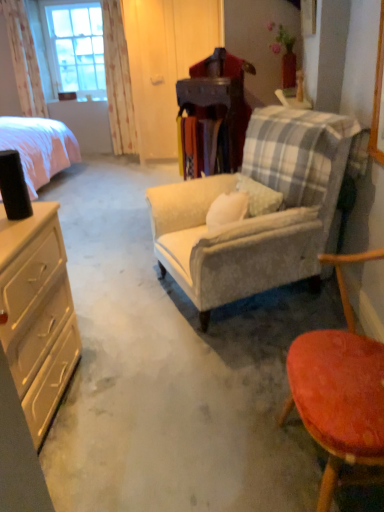
This screenshot has width=384, height=512. Find the location of `vacant space to the left of smooth orange stool at lower right, positioned as the first chair in front-to-back order`. vacant space to the left of smooth orange stool at lower right, positioned as the first chair in front-to-back order is located at coordinates (214, 457).